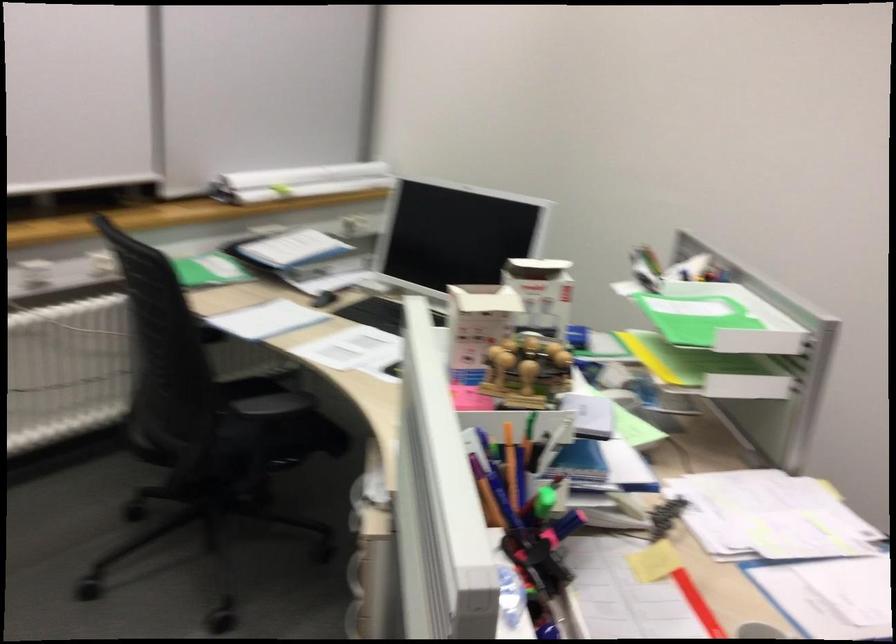
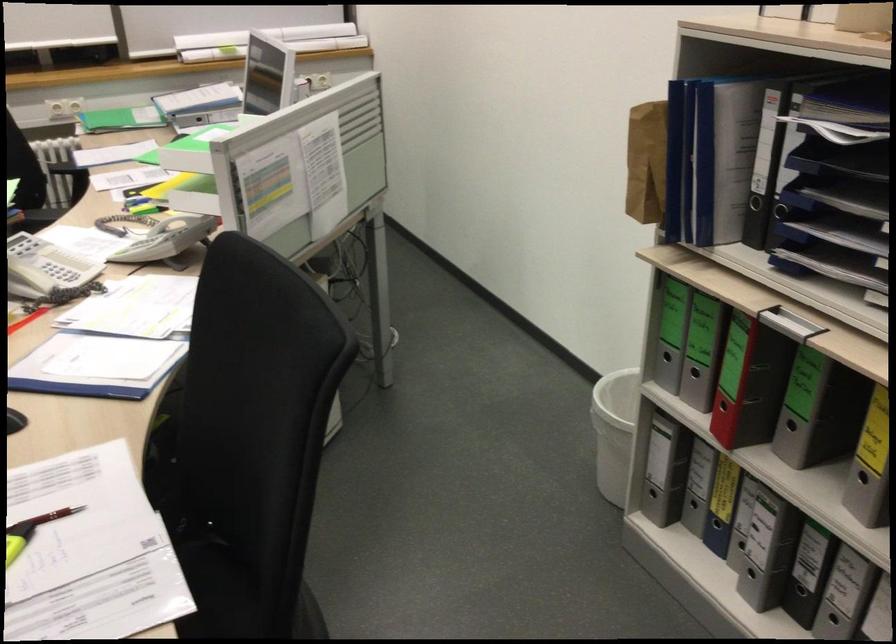
In the second image, find the point that corresponds to the point at 651,556 in the first image.

(26, 319)